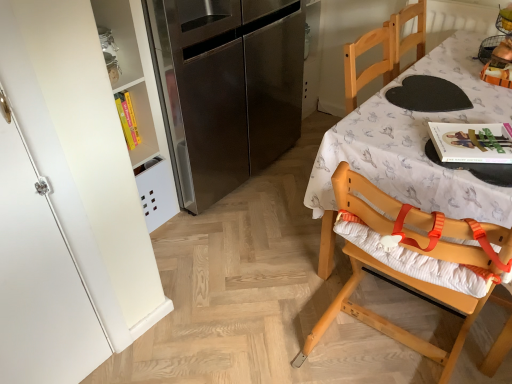
Where is `vacant space to the left of wooden chair at right`? The image size is (512, 384). vacant space to the left of wooden chair at right is located at coordinates (291, 239).